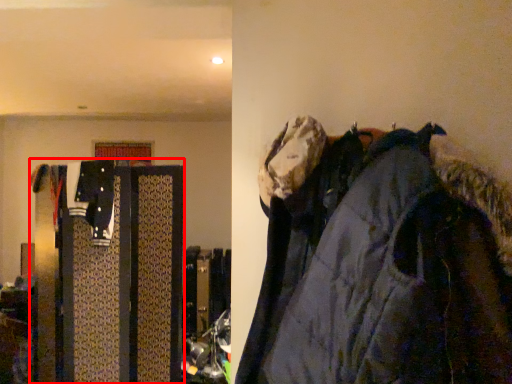
Question: Observing the image, what is the correct spatial positioning of closet (annotated by the red box) in reference to jacket?

Choices:
 (A) left
 (B) right

Answer: (A)